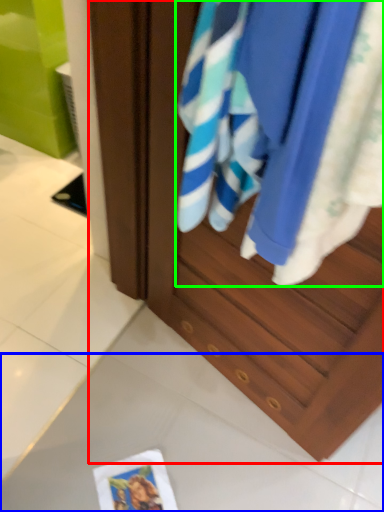
Question: Which object is the closest to the cabinetry (highlighted by a red box)? Choose among these: tile (highlighted by a blue box) or beach towel (highlighted by a green box).

Choices:
 (A) tile
 (B) beach towel

Answer: (B)